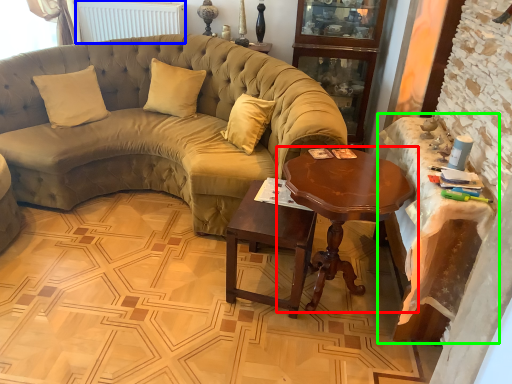
Question: Which is farther away from coffee table (highlighted by a red box)? radiator (highlighted by a blue box) or table (highlighted by a green box)?

Choices:
 (A) radiator
 (B) table

Answer: (A)